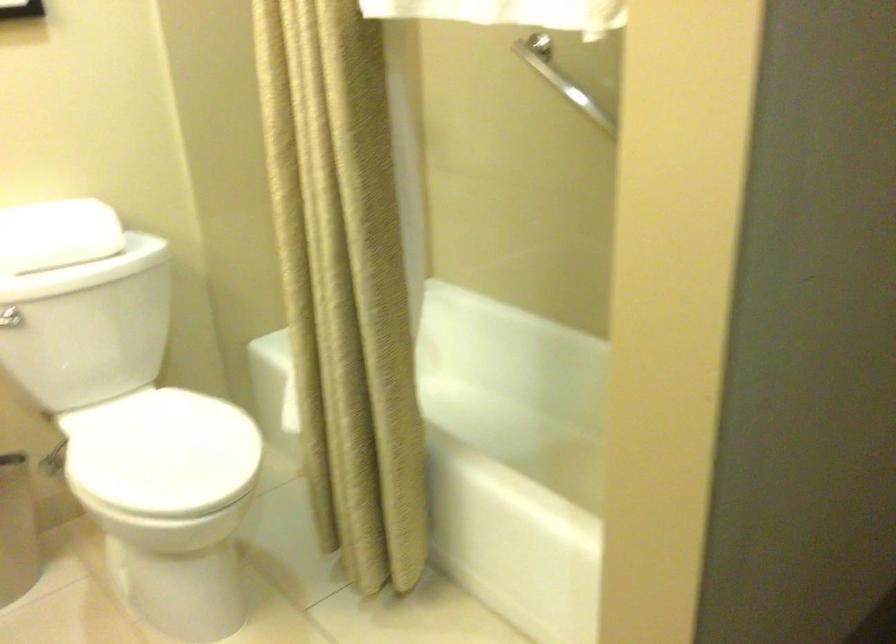
Find where to push the toilet flush handle. Please return your answer as a coordinate pair (x, y).

(10, 317)